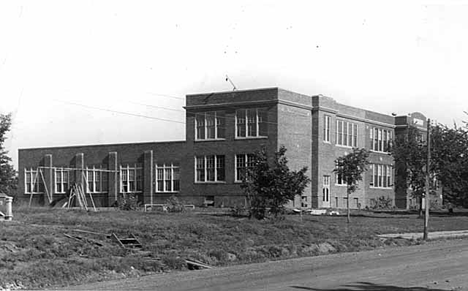
Find the location of a particular element. This screenshot has width=468, height=291. door is located at coordinates (324, 193).